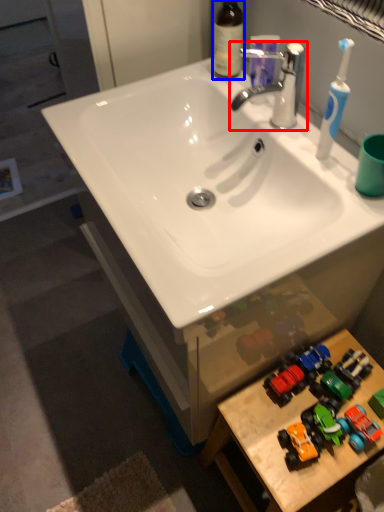
Question: Which point is further to the camera, tap (highlighted by a red box) or bottle (highlighted by a blue box)?

Choices:
 (A) tap
 (B) bottle

Answer: (B)